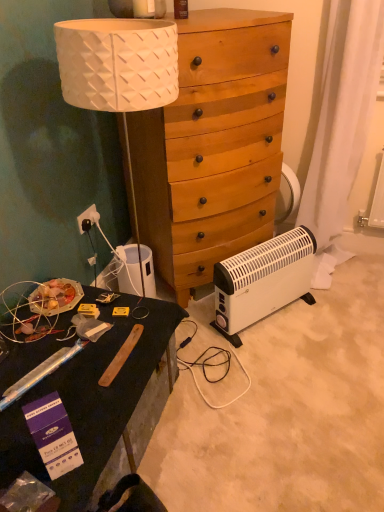
Find the location of a particular element. This screenshot has height=512, width=384. free point to the left of purple cardboard box at lower left is located at coordinates (17, 457).